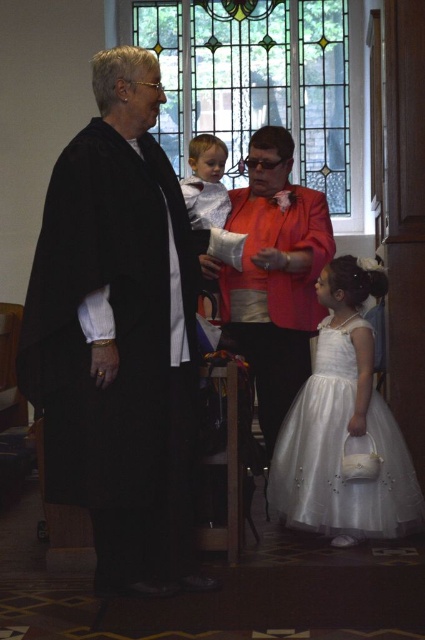
Is the position of black matte robe at left more distant than that of matte red jacket at center?

No, it is in front of matte red jacket at center.

Does black matte robe at left appear under matte red jacket at center?

Yes.

In order to click on black matte robe at left in this screenshot , I will do `click(118, 352)`.

Is matte red jacket at center smaller than light gray fabric shirt at center?

Actually, matte red jacket at center might be larger than light gray fabric shirt at center.

In the scene shown: Which is above, matte red jacket at center or light gray fabric shirt at center?

light gray fabric shirt at center

Find the location of `matte red jacket at center`. matte red jacket at center is located at coordinates (306, 269).

Find the location of a particular element. The height and width of the screenshot is (640, 425). matte red jacket at center is located at coordinates (306, 269).

Can you confirm if stained glass window at upper center is positioned to the right of matte red jacket at center?

Indeed, stained glass window at upper center is positioned on the right side of matte red jacket at center.

Between stained glass window at upper center and matte red jacket at center, which one appears on the left side from the viewer's perspective?

Positioned to the left is matte red jacket at center.

Does point (172, 118) lie behind point (223, 300)?

Yes, point (172, 118) is behind point (223, 300).

At what (x,y) coordinates should I click in order to perform the action: click on stained glass window at upper center. Please return your answer as a coordinate pair (x, y). This screenshot has width=425, height=640. Looking at the image, I should click on (274, 83).